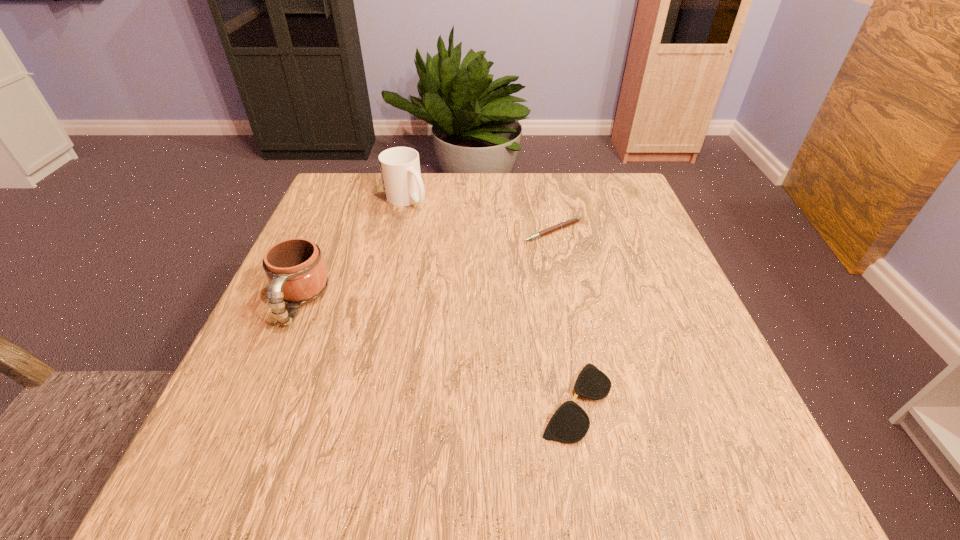
Image resolution: width=960 pixels, height=540 pixels. Identify the location of the third object from right to left. (400, 169).

Locate an element on the screen. the right mug is located at coordinates (400, 169).

Image resolution: width=960 pixels, height=540 pixels. I want to click on the shorter mug, so click(x=295, y=268).

You are a GUI agent. You are given a task and a screenshot of the screen. Output one action in this format:
    pyautogui.click(x=<x>, y=<y>)
    Task: Click on the nearer mug
    
    Given the screenshot: What is the action you would take?
    pyautogui.click(x=295, y=268)

Where is `the third tallest object`? This screenshot has height=540, width=960. the third tallest object is located at coordinates (573, 220).

Locate an element on the screen. Image resolution: width=960 pixels, height=540 pixels. the second farthest object is located at coordinates (573, 220).

Identify the location of spectacles. (570, 423).

The width and height of the screenshot is (960, 540). I want to click on the shortest object, so click(x=570, y=423).

This screenshot has height=540, width=960. What are the coordinates of `vacant region located 0.350m on the front of the farther mug` in the screenshot? It's located at (380, 315).

Where is `free space located 0.140m on the side of the leftmost object with the handle`? This screenshot has width=960, height=540. free space located 0.140m on the side of the leftmost object with the handle is located at coordinates (257, 401).